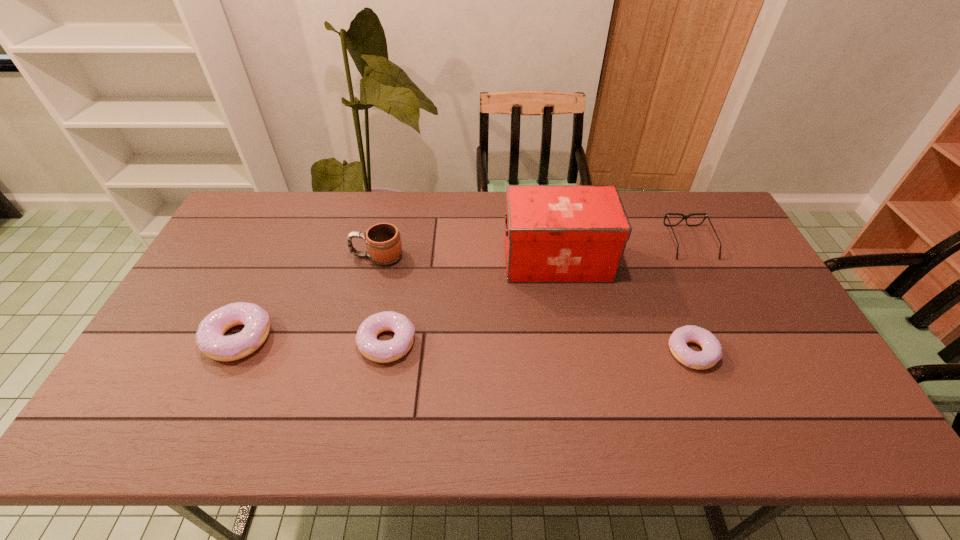
Where is `object positioned at the left edge`? object positioned at the left edge is located at coordinates (210, 339).

I want to click on object at the right edge, so click(706, 215).

Identify the location of object at the far right corner. This screenshot has height=540, width=960. (706, 215).

Locate an element on the screen. This screenshot has height=540, width=960. free space at the far edge is located at coordinates (650, 214).

Locate an element on the screen. free space at the near edge of the desktop is located at coordinates (731, 390).

Locate an element on the screen. vacant position at the left edge of the desktop is located at coordinates (221, 268).

Locate an element on the screen. Image resolution: width=960 pixels, height=540 pixels. vacant space at the right edge of the desktop is located at coordinates (749, 320).

The height and width of the screenshot is (540, 960). I want to click on vacant space at the far left corner of the desktop, so click(x=252, y=209).

You are a GUI agent. You are given a task and a screenshot of the screen. Output one action in this format:
    pyautogui.click(x=<x>, y=<y>)
    Task: Click on the free space between the leftmost object and the shortest doughnut
    
    Given the screenshot: What is the action you would take?
    pyautogui.click(x=466, y=345)

The height and width of the screenshot is (540, 960). Identify the location of free area in between the shortest doughnut and the first-aid kit. (625, 306).